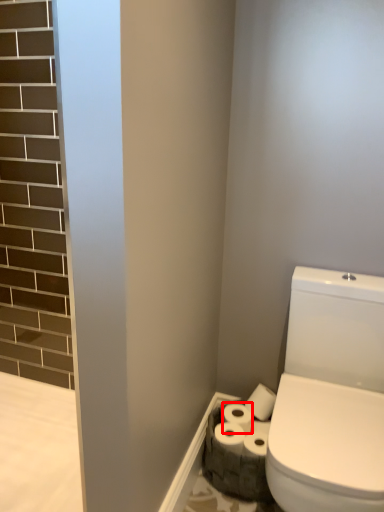
Question: Observing the image, what is the correct spatial positioning of toilet paper (annotated by the red box) in reference to toilet paper?

Choices:
 (A) left
 (B) right

Answer: (B)